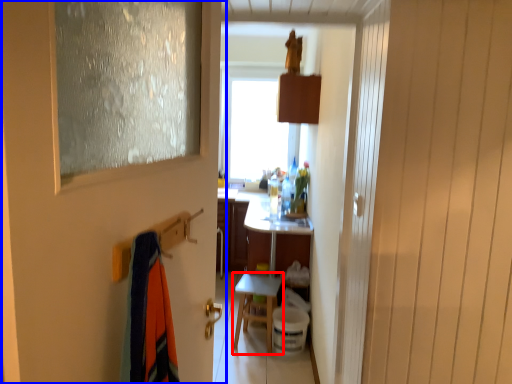
Question: Which object appears farthest to the camera in this image, table (highlighted by a red box) or door (highlighted by a blue box)?

Choices:
 (A) table
 (B) door

Answer: (A)